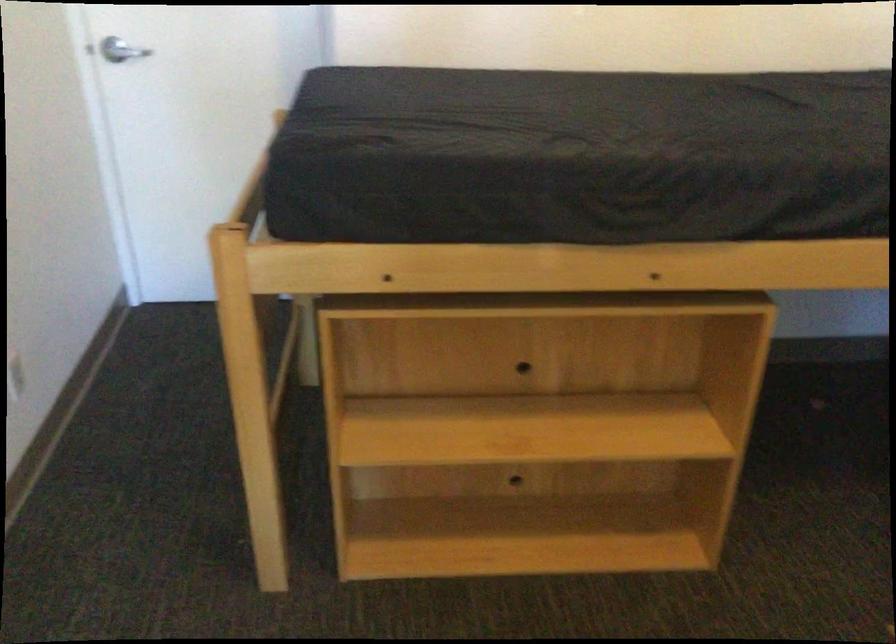
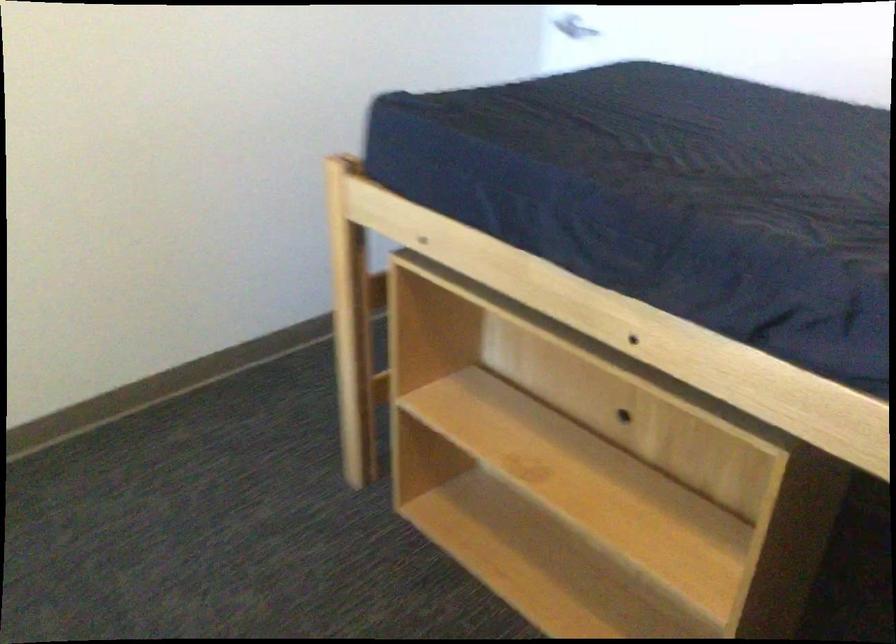
The point at (328, 265) is marked in the first image. Where is the corresponding point in the second image?

(392, 214)